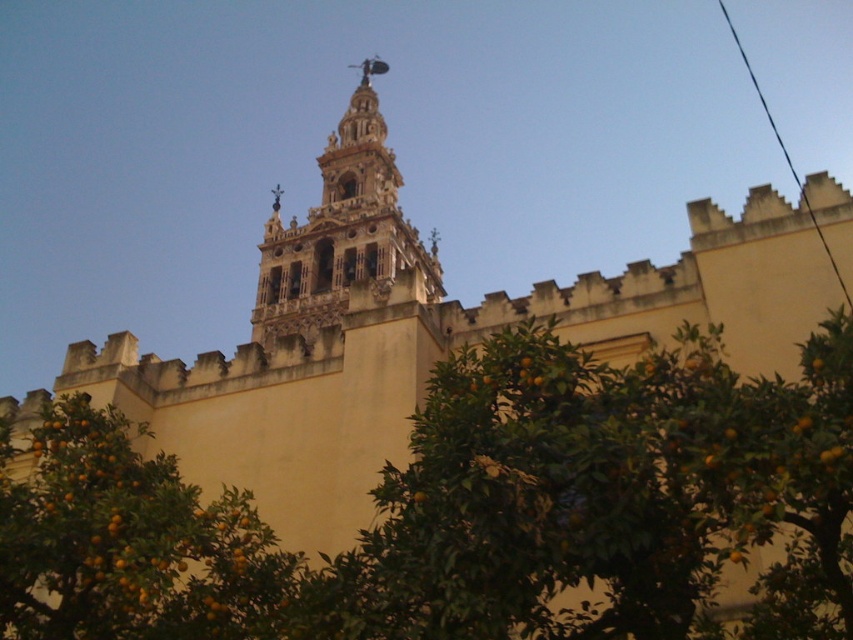
From the picture: Is orange matte at lower left taller than golden stone church tower at center?

Incorrect, orange matte at lower left's height is not larger of golden stone church tower at center's.

Can you confirm if orange matte at lower left is bigger than golden stone church tower at center?

No, orange matte at lower left is not bigger than golden stone church tower at center.

Measure the distance between orange matte at lower left and camera.

orange matte at lower left is 28.10 meters away from camera.

Find the location of a particular element. The height and width of the screenshot is (640, 853). orange matte at lower left is located at coordinates (128, 541).